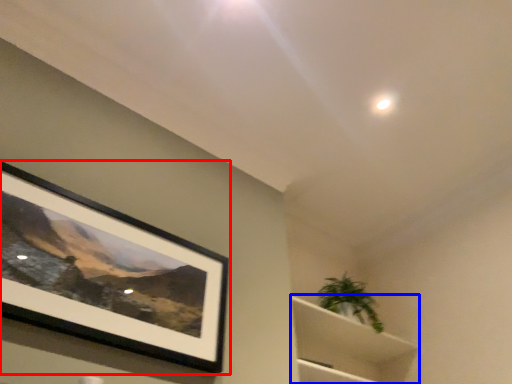
Question: Which of the following is the closest to the observer, picture frame (highlighted by a red box) or cabinet (highlighted by a blue box)?

Choices:
 (A) picture frame
 (B) cabinet

Answer: (A)